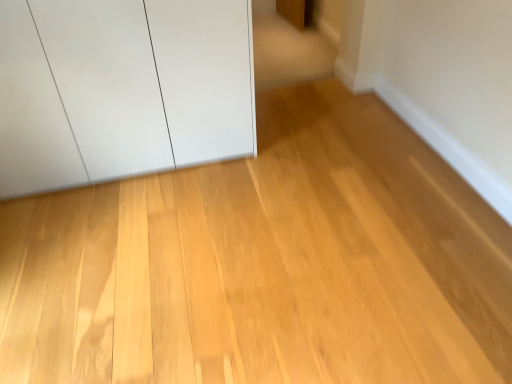
The height and width of the screenshot is (384, 512). I want to click on unoccupied region to the right of white matte cupboard at upper left, so click(x=288, y=172).